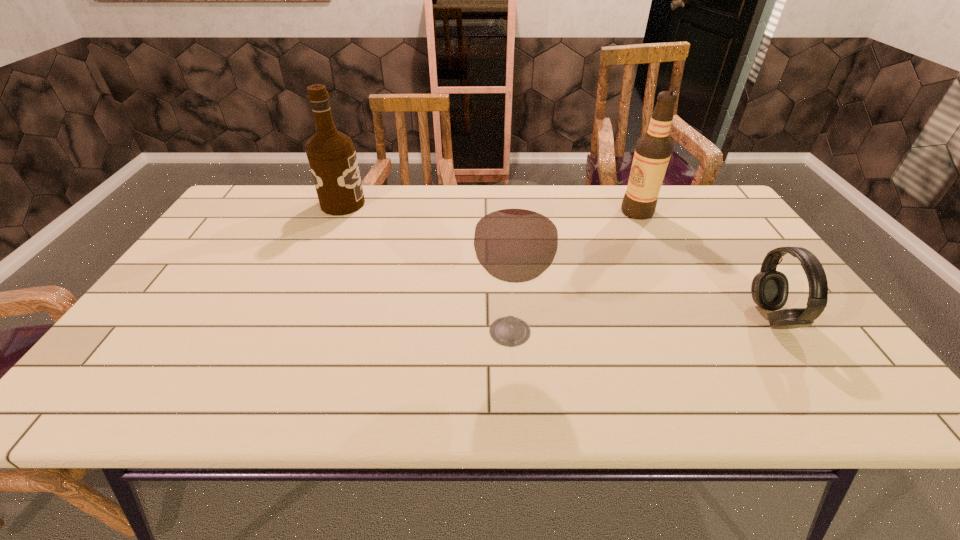
I want to click on vacant region located 0.080m on the front of the second alcohol from right to left, so click(x=515, y=393).

Image resolution: width=960 pixels, height=540 pixels. I want to click on free space located 0.220m on the earcups of the shortest object, so click(662, 317).

Locate an element on the screen. This screenshot has width=960, height=540. vacant space situated 0.320m on the earcups of the shortest object is located at coordinates (620, 317).

At what (x,y) coordinates should I click in order to perform the action: click on free space located on the earcups of the shortest object. Please return your answer as a coordinate pair (x, y). Looking at the image, I should click on (722, 317).

Locate an element on the screen. object present at the right edge is located at coordinates (770, 288).

Locate an element on the screen. free region at the far edge of the desktop is located at coordinates (616, 208).

Image resolution: width=960 pixels, height=540 pixels. I want to click on vacant region at the near edge of the desktop, so click(x=457, y=375).

Image resolution: width=960 pixels, height=540 pixels. Identify the location of vacant space at the right edge of the desktop. (734, 292).

Where is `blank area at the far left corner`? This screenshot has height=540, width=960. blank area at the far left corner is located at coordinates (294, 185).

Where is `empty space that is in between the leftmost object and the second object from left to right`? The image size is (960, 540). empty space that is in between the leftmost object and the second object from left to right is located at coordinates (426, 268).